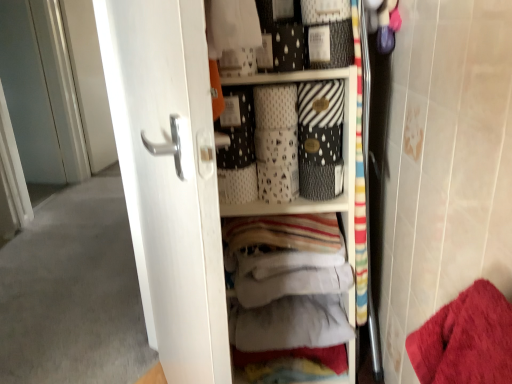
Question: Can white glossy door at center, which is the 1th screen door from right to left, be found inside white matte baskets at upper center?

Choices:
 (A) no
 (B) yes

Answer: (A)

Question: Considering the relative sizes of white matte baskets at upper center and white glossy door at center, the first screen door viewed from the front, in the image provided, is white matte baskets at upper center wider than white glossy door at center, the first screen door viewed from the front,?

Choices:
 (A) yes
 (B) no

Answer: (A)

Question: From a real-world perspective, is white matte baskets at upper center positioned under white glossy door at center, which is the 1th screen door from right to left, based on gravity?

Choices:
 (A) yes
 (B) no

Answer: (A)

Question: Is white matte baskets at upper center not within white glossy door at center, the 2th screen door viewed from the left?

Choices:
 (A) no
 (B) yes

Answer: (B)

Question: Is white matte baskets at upper center shorter than white glossy door at center, which is the 1th screen door from right to left?

Choices:
 (A) yes
 (B) no

Answer: (A)

Question: From a real-world perspective, relative to white glossy door at left, the second screen door from the right, is white matte baskets at upper center vertically above or below?

Choices:
 (A) below
 (B) above

Answer: (A)

Question: Considering their positions, is white matte baskets at upper center located in front of or behind white glossy door at left, which is the 1th screen door in left-to-right order?

Choices:
 (A) behind
 (B) front

Answer: (B)

Question: Would you say white matte baskets at upper center is inside or outside white glossy door at left, the second screen door from the right?

Choices:
 (A) inside
 (B) outside

Answer: (B)

Question: Considering the relative positions of white matte baskets at upper center and white glossy door at left, which is the 1th screen door in left-to-right order, in the image provided, is white matte baskets at upper center to the left or to the right of white glossy door at left, which is the 1th screen door in left-to-right order,?

Choices:
 (A) left
 (B) right

Answer: (B)

Question: Is white glossy door at center, the first screen door viewed from the front, wider or thinner than white matte baskets at upper center?

Choices:
 (A) thin
 (B) wide

Answer: (A)

Question: Would you say white glossy door at center, which is the 1th screen door from right to left, is inside or outside white matte baskets at upper center?

Choices:
 (A) inside
 (B) outside

Answer: (B)

Question: From a real-world perspective, is white glossy door at center, the second screen door positioned from the back, physically located above or below white matte baskets at upper center?

Choices:
 (A) above
 (B) below

Answer: (A)

Question: Considering the positions of white glossy door at center, the first screen door viewed from the front, and white matte baskets at upper center in the image, is white glossy door at center, the first screen door viewed from the front, bigger or smaller than white matte baskets at upper center?

Choices:
 (A) small
 (B) big

Answer: (B)

Question: From the image's perspective, relative to white glossy door at center, the first screen door viewed from the front, is white matte baskets at upper center above or below?

Choices:
 (A) above
 (B) below

Answer: (A)

Question: Is white matte baskets at upper center inside the boundaries of white glossy door at center, the second screen door positioned from the back, or outside?

Choices:
 (A) inside
 (B) outside

Answer: (B)